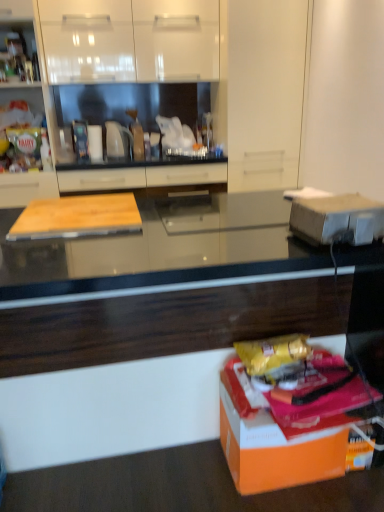
Describe the element at coordinates (161, 324) in the screenshot. I see `black glossy countertop at center` at that location.

Measure the distance between black glossy countertop at center and camera.

black glossy countertop at center and camera are 1.16 meters apart from each other.

How much space does matte wood cutting board at center, the first cabinetry when ordered from right to left, occupy horizontally?

matte wood cutting board at center, the first cabinetry when ordered from right to left, is 2.50 centimeters in width.

Locate an element on the screen. white glossy cabinet at upper center, the second cabinetry from the right is located at coordinates (130, 40).

Considering the sizes of orange matte cardboard box at lower right, positioned as the 1th cardboard box in bottom-to-top order, and white cardboard box at right, the second cardboard box in the bottom-to-top sequence, in the image, is orange matte cardboard box at lower right, positioned as the 1th cardboard box in bottom-to-top order, wider or thinner than white cardboard box at right, the second cardboard box in the bottom-to-top sequence,?

Considering their sizes, orange matte cardboard box at lower right, positioned as the 1th cardboard box in bottom-to-top order, looks broader than white cardboard box at right, the second cardboard box in the bottom-to-top sequence.

Are orange matte cardboard box at lower right, positioned as the 1th cardboard box in bottom-to-top order, and white cardboard box at right, marked as the first cardboard box in a top-to-bottom arrangement, far apart?

No.

From a real-world perspective, which object stands above the other?

From a 3D spatial view, white cardboard box at right, the second cardboard box in the bottom-to-top sequence, is above.

Is orange matte cardboard box at lower right, which is the 2th cardboard box from top to bottom, taller or shorter than white cardboard box at right, marked as the first cardboard box in a top-to-bottom arrangement?

In the image, orange matte cardboard box at lower right, which is the 2th cardboard box from top to bottom, appears to be taller than white cardboard box at right, marked as the first cardboard box in a top-to-bottom arrangement.

Is orange matte cardboard box at lower right, positioned as the 1th cardboard box in bottom-to-top order, oriented towards black glossy countertop at center?

No, orange matte cardboard box at lower right, positioned as the 1th cardboard box in bottom-to-top order, is not aimed at black glossy countertop at center.

Considering the sizes of objects orange matte cardboard box at lower right, positioned as the 1th cardboard box in bottom-to-top order, and black glossy countertop at center in the image provided, who is shorter, orange matte cardboard box at lower right, positioned as the 1th cardboard box in bottom-to-top order, or black glossy countertop at center?

Standing shorter between the two is orange matte cardboard box at lower right, positioned as the 1th cardboard box in bottom-to-top order.

Considering the sizes of objects orange matte cardboard box at lower right, which is the 2th cardboard box from top to bottom, and black glossy countertop at center in the image provided, who is bigger, orange matte cardboard box at lower right, which is the 2th cardboard box from top to bottom, or black glossy countertop at center?

Bigger between the two is black glossy countertop at center.

Based on the photo, can you confirm if orange matte cardboard box at lower right, which is the 2th cardboard box from top to bottom, is wider than black glossy countertop at center?

No, orange matte cardboard box at lower right, which is the 2th cardboard box from top to bottom, is not wider than black glossy countertop at center.

From their relative heights in the image, would you say matte wood cutting board at center, the first cabinetry when ordered from right to left, is taller or shorter than black glossy countertop at center?

In the image, matte wood cutting board at center, the first cabinetry when ordered from right to left, appears to be taller than black glossy countertop at center.

Would you say matte wood cutting board at center, which is the third cabinetry from left to right, is outside black glossy countertop at center?

Absolutely, matte wood cutting board at center, which is the third cabinetry from left to right, is external to black glossy countertop at center.

In the scene shown: Which is nearer, (52, 75) or (41, 354)?

Point (52, 75) is positioned farther from the camera compared to point (41, 354).

Is matte wood cutting board at center, the first cabinetry when ordered from right to left, looking in the opposite direction of black glossy countertop at center?

No, matte wood cutting board at center, the first cabinetry when ordered from right to left, is not facing the opposite direction of black glossy countertop at center.

How far apart are wooden cutting board at left, the 3th cabinetry when ordered from right to left, and orange matte cardboard box at lower right, which is the 2th cardboard box from top to bottom?

wooden cutting board at left, the 3th cabinetry when ordered from right to left, is 7.29 feet from orange matte cardboard box at lower right, which is the 2th cardboard box from top to bottom.

Is wooden cutting board at left, which ranks as the 1th cabinetry in left-to-right order, oriented towards orange matte cardboard box at lower right, which is the 2th cardboard box from top to bottom?

No, wooden cutting board at left, which ranks as the 1th cabinetry in left-to-right order, does not turn towards orange matte cardboard box at lower right, which is the 2th cardboard box from top to bottom.

Is wooden cutting board at left, which ranks as the 1th cabinetry in left-to-right order, next to orange matte cardboard box at lower right, positioned as the 1th cardboard box in bottom-to-top order, and touching it?

wooden cutting board at left, which ranks as the 1th cabinetry in left-to-right order, and orange matte cardboard box at lower right, positioned as the 1th cardboard box in bottom-to-top order, are not in contact.

Who is bigger, wooden cutting board at left, which ranks as the 1th cabinetry in left-to-right order, or orange matte cardboard box at lower right, which is the 2th cardboard box from top to bottom?

wooden cutting board at left, which ranks as the 1th cabinetry in left-to-right order, is bigger.

Looking at this image, which object is closer to the camera taking this photo, matte wood cutting board at center, the first cabinetry when ordered from right to left, or wooden cutting board at left, which ranks as the 1th cabinetry in left-to-right order?

matte wood cutting board at center, the first cabinetry when ordered from right to left, is closer to the camera.

Could you tell me if matte wood cutting board at center, which is the third cabinetry from left to right, is facing wooden cutting board at left, the 3th cabinetry when ordered from right to left?

No, matte wood cutting board at center, which is the third cabinetry from left to right, is not oriented towards wooden cutting board at left, the 3th cabinetry when ordered from right to left.

From a real-world perspective, who is located higher, matte wood cutting board at center, which is the third cabinetry from left to right, or wooden cutting board at left, which ranks as the 1th cabinetry in left-to-right order?

wooden cutting board at left, which ranks as the 1th cabinetry in left-to-right order, from a real-world perspective.

Does point (304, 310) lie in front of point (366, 224)?

No, (304, 310) is further to viewer.

From a real-world perspective, which is physically above, black glossy countertop at center or white cardboard box at right, marked as the first cardboard box in a top-to-bottom arrangement?

white cardboard box at right, marked as the first cardboard box in a top-to-bottom arrangement, from a real-world perspective.

Considering the relative sizes of black glossy countertop at center and white cardboard box at right, the second cardboard box in the bottom-to-top sequence, in the image provided, is black glossy countertop at center smaller than white cardboard box at right, the second cardboard box in the bottom-to-top sequence,?

No.

Is black glossy countertop at center spatially inside white cardboard box at right, the second cardboard box in the bottom-to-top sequence, or outside of it?

black glossy countertop at center lies outside white cardboard box at right, the second cardboard box in the bottom-to-top sequence.

Which is behind, point (70, 2) or point (48, 184)?

The point (48, 184) is farther from the camera.

Is white glossy cabinet at upper center, the 2th cabinetry from the left, oriented away from wooden cutting board at left, which ranks as the 1th cabinetry in left-to-right order?

No, white glossy cabinet at upper center, the 2th cabinetry from the left, is not facing the opposite direction of wooden cutting board at left, which ranks as the 1th cabinetry in left-to-right order.

In order to click on cabinetry above the wooden cutting board at left, the 3th cabinetry when ordered from right to left (from a real-world perspective) in this screenshot , I will do `click(130, 40)`.

Is the position of white glossy cabinet at upper center, the 2th cabinetry from the left, less distant than that of wooden cutting board at left, which ranks as the 1th cabinetry in left-to-right order?

No, white glossy cabinet at upper center, the 2th cabinetry from the left, is further to the viewer.

You are a GUI agent. You are given a task and a screenshot of the screen. Output one action in this format:
    pyautogui.click(x=<x>, y=<y>)
    Task: Click on the cardboard box above the orange matte cardboard box at lower right, which is the 2th cardboard box from top to bottom (from a real-world perspective)
    
    Given the screenshot: What is the action you would take?
    pyautogui.click(x=337, y=219)

At what (x,y) coordinates should I click in order to perform the action: click on countertop above the orange matte cardboard box at lower right, which is the 2th cardboard box from top to bottom (from the image's perspective). Please return your answer as a coordinate pair (x, y). This screenshot has height=512, width=384. Looking at the image, I should click on (161, 324).

From the image, which object appears to be farther from matte wood cutting board at center, the first cabinetry when ordered from right to left, white glossy cabinet at upper center, the 2th cabinetry from the left, or orange matte cardboard box at lower right, which is the 2th cardboard box from top to bottom?

orange matte cardboard box at lower right, which is the 2th cardboard box from top to bottom, lies further to matte wood cutting board at center, the first cabinetry when ordered from right to left, than the other object.

Estimate the real-world distances between objects in this image. Which object is further from white cardboard box at right, marked as the first cardboard box in a top-to-bottom arrangement, black glossy countertop at center or white glossy cabinet at upper center, the second cabinetry from the right?

Among the two, white glossy cabinet at upper center, the second cabinetry from the right, is located further to white cardboard box at right, marked as the first cardboard box in a top-to-bottom arrangement.

From the image, which object appears to be nearer to wooden cutting board at left, the 3th cabinetry when ordered from right to left, white cardboard box at right, marked as the first cardboard box in a top-to-bottom arrangement, or orange matte cardboard box at lower right, which is the 2th cardboard box from top to bottom?

Based on the image, white cardboard box at right, marked as the first cardboard box in a top-to-bottom arrangement, appears to be nearer to wooden cutting board at left, the 3th cabinetry when ordered from right to left.

Which object lies nearer to the anchor point matte wood cutting board at center, the first cabinetry when ordered from right to left, white cardboard box at right, the second cardboard box in the bottom-to-top sequence, or orange matte cardboard box at lower right, which is the 2th cardboard box from top to bottom?

Among the two, white cardboard box at right, the second cardboard box in the bottom-to-top sequence, is located nearer to matte wood cutting board at center, the first cabinetry when ordered from right to left.

From the image, which object appears to be farther from wooden cutting board at left, which ranks as the 1th cabinetry in left-to-right order, white cardboard box at right, marked as the first cardboard box in a top-to-bottom arrangement, or black glossy countertop at center?

white cardboard box at right, marked as the first cardboard box in a top-to-bottom arrangement, is further to wooden cutting board at left, which ranks as the 1th cabinetry in left-to-right order.

From the image, which object appears to be nearer to wooden cutting board at left, the 3th cabinetry when ordered from right to left, orange matte cardboard box at lower right, which is the 2th cardboard box from top to bottom, or black glossy countertop at center?

Among the two, black glossy countertop at center is located nearer to wooden cutting board at left, the 3th cabinetry when ordered from right to left.

Considering their positions, is orange matte cardboard box at lower right, positioned as the 1th cardboard box in bottom-to-top order, positioned further to black glossy countertop at center than wooden cutting board at left, which ranks as the 1th cabinetry in left-to-right order?

wooden cutting board at left, which ranks as the 1th cabinetry in left-to-right order, is further to black glossy countertop at center.

When comparing their distances from black glossy countertop at center, does matte wood cutting board at center, which is the third cabinetry from left to right, or wooden cutting board at left, which ranks as the 1th cabinetry in left-to-right order, seem further?

Among the two, wooden cutting board at left, which ranks as the 1th cabinetry in left-to-right order, is located further to black glossy countertop at center.

This screenshot has width=384, height=512. Find the location of `cardboard box between white cardboard box at right, the second cardboard box in the bottom-to-top sequence, and matte wood cutting board at center, the first cabinetry when ordered from right to left, along the z-axis`. cardboard box between white cardboard box at right, the second cardboard box in the bottom-to-top sequence, and matte wood cutting board at center, the first cabinetry when ordered from right to left, along the z-axis is located at coordinates (273, 444).

Locate an element on the screen. The height and width of the screenshot is (512, 384). countertop between white cardboard box at right, the second cardboard box in the bottom-to-top sequence, and matte wood cutting board at center, which is the third cabinetry from left to right, in the front-back direction is located at coordinates point(161,324).

Where is `countertop between wooden cutting board at left, which ranks as the 1th cabinetry in left-to-right order, and white cardboard box at right, the second cardboard box in the bottom-to-top sequence, in the horizontal direction`? countertop between wooden cutting board at left, which ranks as the 1th cabinetry in left-to-right order, and white cardboard box at right, the second cardboard box in the bottom-to-top sequence, in the horizontal direction is located at coordinates (161, 324).

Identify the location of cabinetry between wooden cutting board at left, the 3th cabinetry when ordered from right to left, and matte wood cutting board at center, the first cabinetry when ordered from right to left, from left to right. Image resolution: width=384 pixels, height=512 pixels. (130, 40).